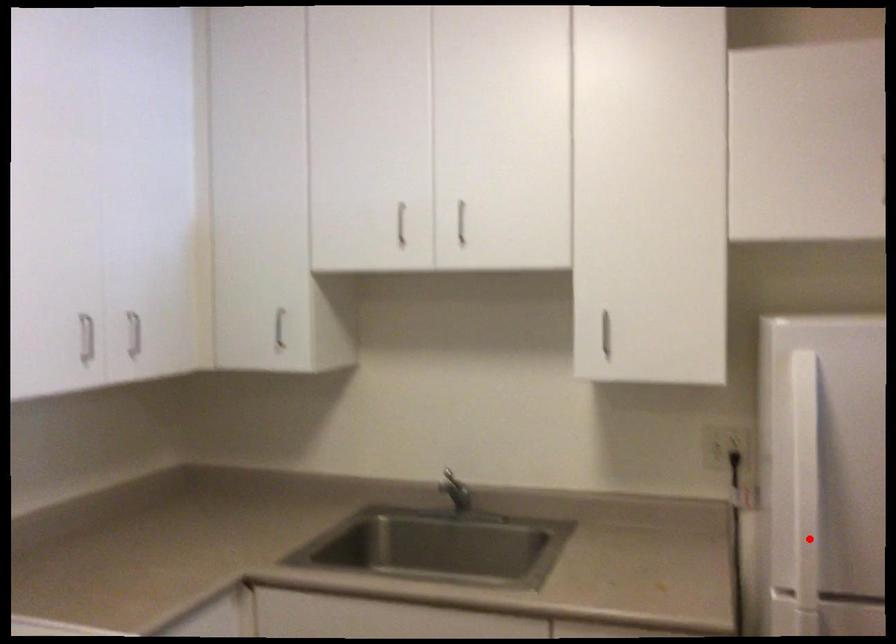
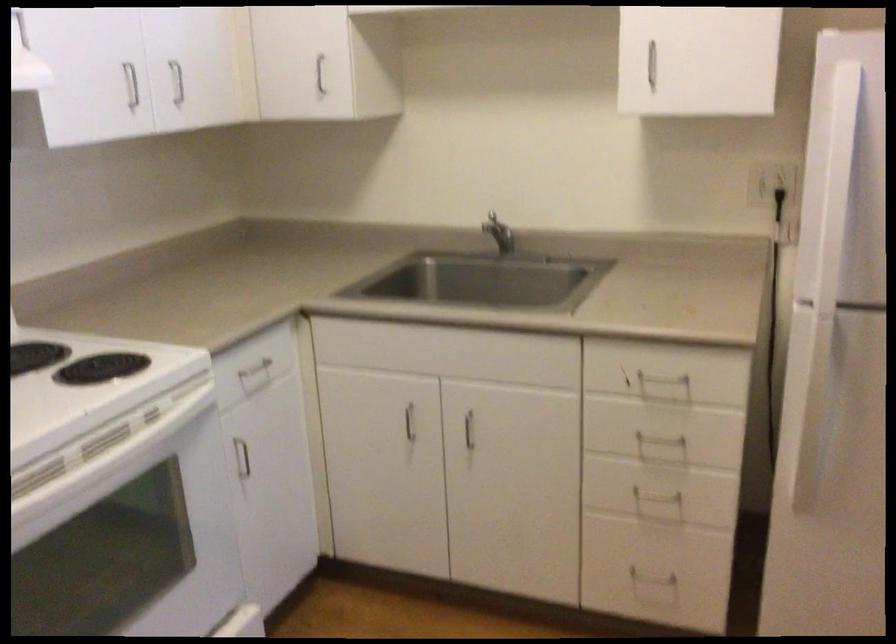
Where in the second image is the point corresponding to the highlighted location from the first image?

(831, 240)